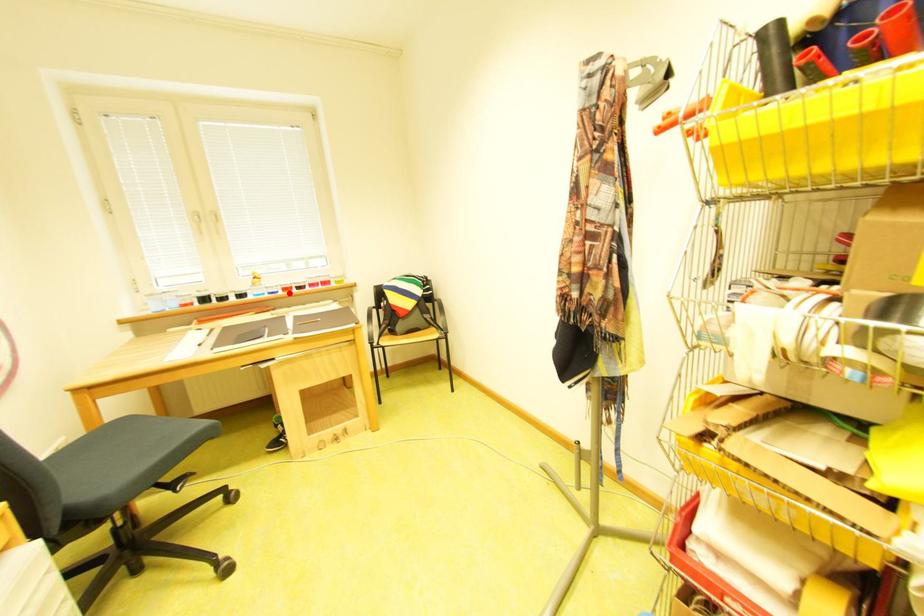
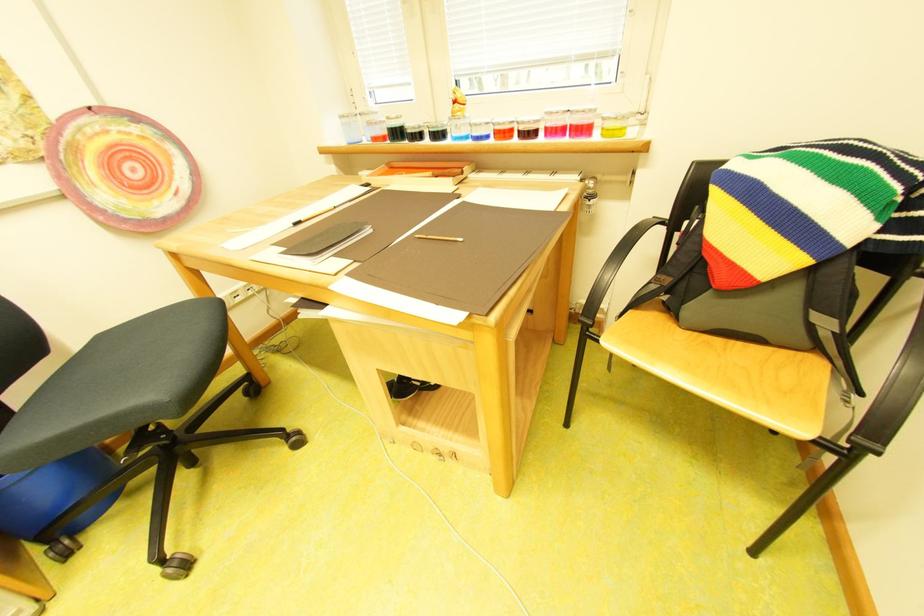
Where in the second image is the point corresponding to the highlighted location from the first image?

(499, 138)